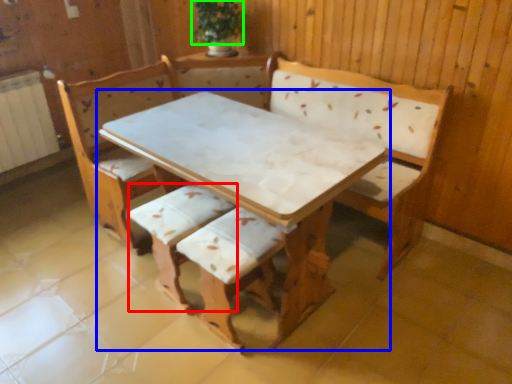
Question: Which object is positioned closest to armchair (highlighted by a red box)? Select from table (highlighted by a blue box) and plant (highlighted by a green box).

Choices:
 (A) table
 (B) plant

Answer: (A)